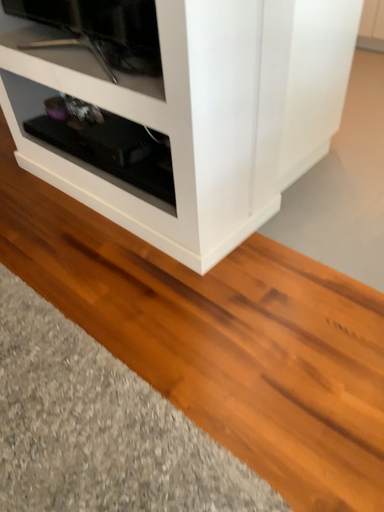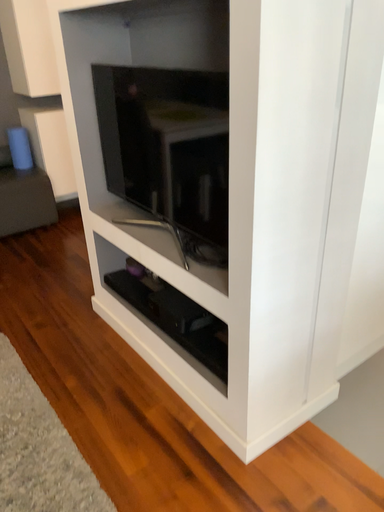
Question: How did the camera likely rotate when shooting the video?

Choices:
 (A) rotated downward
 (B) rotated upward

Answer: (B)